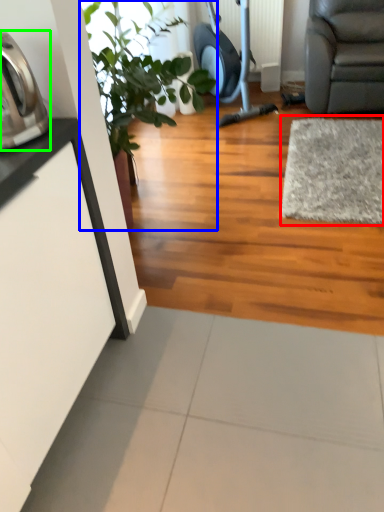
Question: Which is farther away from mat (highlighted by a red box)? houseplant (highlighted by a blue box) or appliance (highlighted by a green box)?

Choices:
 (A) houseplant
 (B) appliance

Answer: (B)